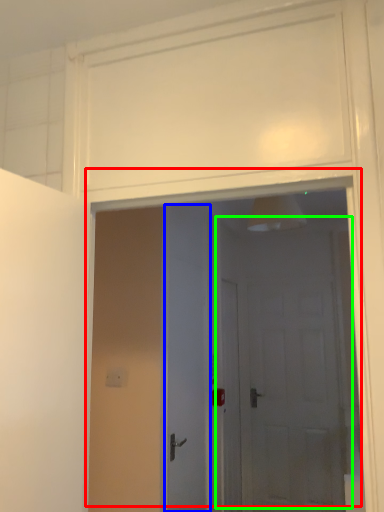
Question: Considering the real-world distances, which object is closest to door (highlighted by a red box)? door (highlighted by a blue box) or door (highlighted by a green box).

Choices:
 (A) door
 (B) door

Answer: (B)